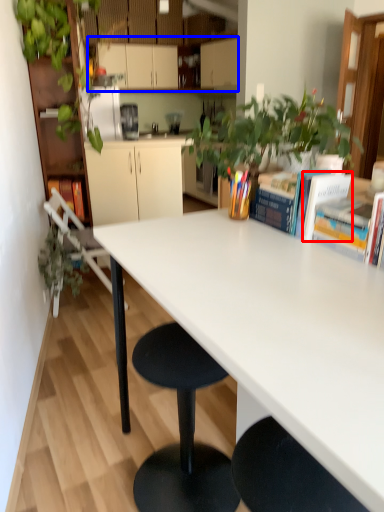
Question: Among these objects, which one is farthest to the camera, book (highlighted by a red box) or cabinetry (highlighted by a blue box)?

Choices:
 (A) book
 (B) cabinetry

Answer: (B)